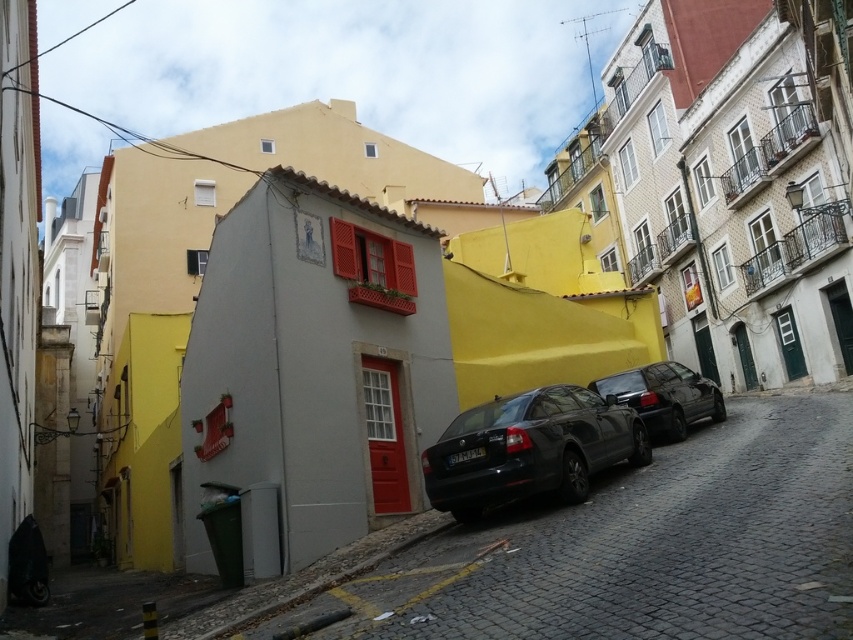
Question: Is smooth gray wall at center above shiny black car at center-right?

Choices:
 (A) yes
 (B) no

Answer: (B)

Question: From the image, what is the correct spatial relationship of smooth gray wall at center in relation to shiny black car at center-right?

Choices:
 (A) below
 (B) above

Answer: (A)

Question: Which point appears closest to the camera in this image?

Choices:
 (A) (753, 532)
 (B) (560, 396)
 (C) (624, 376)

Answer: (A)

Question: Which of the following is the farthest from the observer?

Choices:
 (A) matte black car at center
 (B) shiny black car at center-right
 (C) smooth gray wall at center

Answer: (B)

Question: Can you confirm if smooth gray wall at center is positioned to the left of shiny black car at center-right?

Choices:
 (A) no
 (B) yes

Answer: (B)

Question: Which object appears farthest from the camera in this image?

Choices:
 (A) smooth gray wall at center
 (B) shiny black car at center-right
 (C) matte black car at center

Answer: (B)